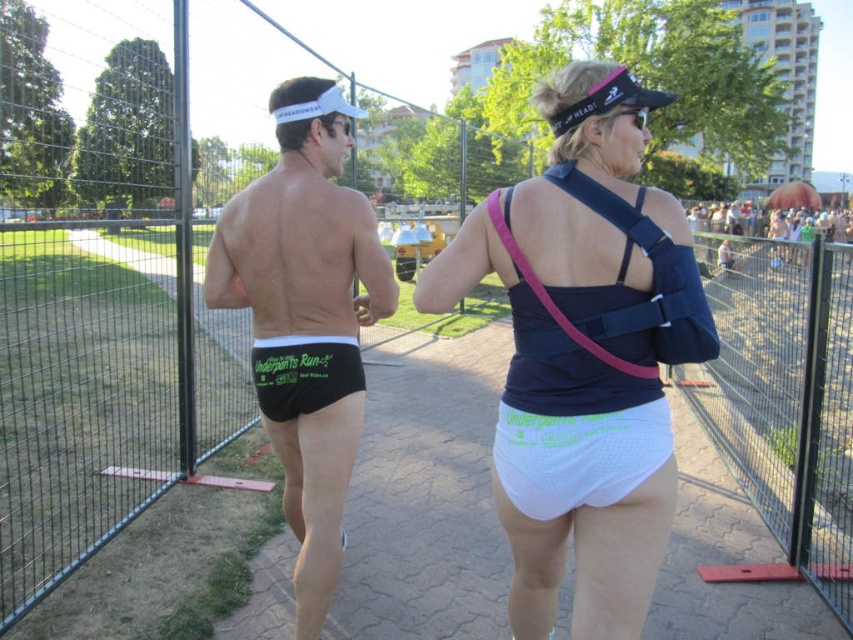
You are a photographer at the Underpants Run event. You need to capture a photo that includes both the black matte underwear at center and the black mesh shorts at center. Based on their positions, which one should you focus on first to ensure both are in the frame?

The black matte underwear at center is to the left of black mesh shorts at center, so you should focus on the black mesh shorts at center first to ensure both are in the frame.

You are a photographer at the Underpants Run event. You want to take a photo of the black matte underwear at center and black mesh shorts at center. The minimum distance required for your camera to focus on both items clearly is 8 inches. Will your camera be able to focus on both items at the same time?

The black matte underwear at center and black mesh shorts at center are 7.62 inches apart, which is less than the 8 inches required for the camera to focus clearly. Therefore, the camera may not be able to focus on both items simultaneously.